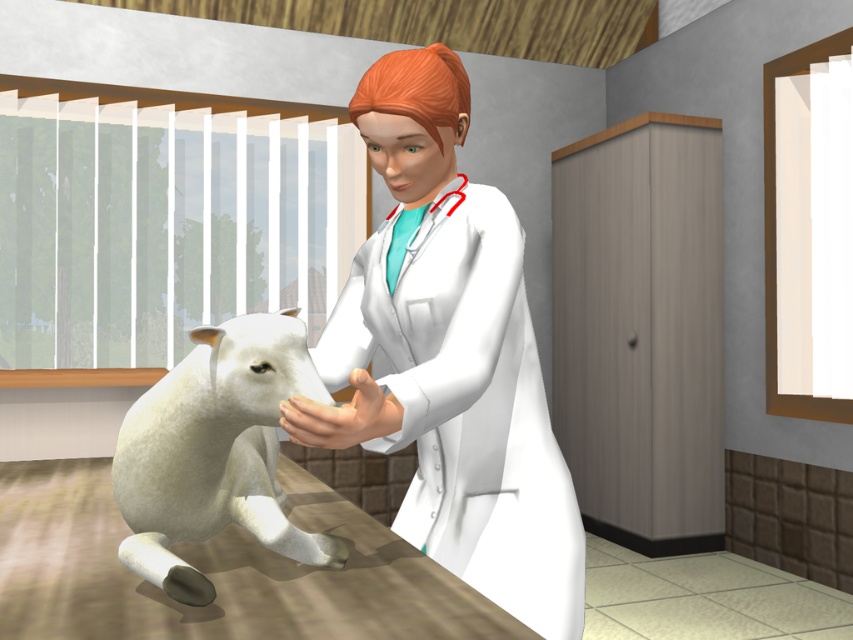
You are a new intern at the veterinary clinic and need to locate the white matte coat at center for an upcoming procedure. Based on the coordinates provided, where would you find this coat in relation to the room?

The white matte coat at center is located at the coordinates point [450,356], which would place it near the central area of the room.

In the scene shown: You are a patient in the veterinary clinic and see the white matte coat at center and the white woolen lamb at center. Which object is closer to the ceiling?

The white matte coat at center is located above the white woolen lamb at center, so it is closer to the ceiling.

You are a patient in the veterinary clinic and need to locate the white woolen lamb at center and the white matte coat at center. Based on the scene, which object is positioned to the right of the other?

The white matte coat at center is to the right of the white woolen lamb at center.